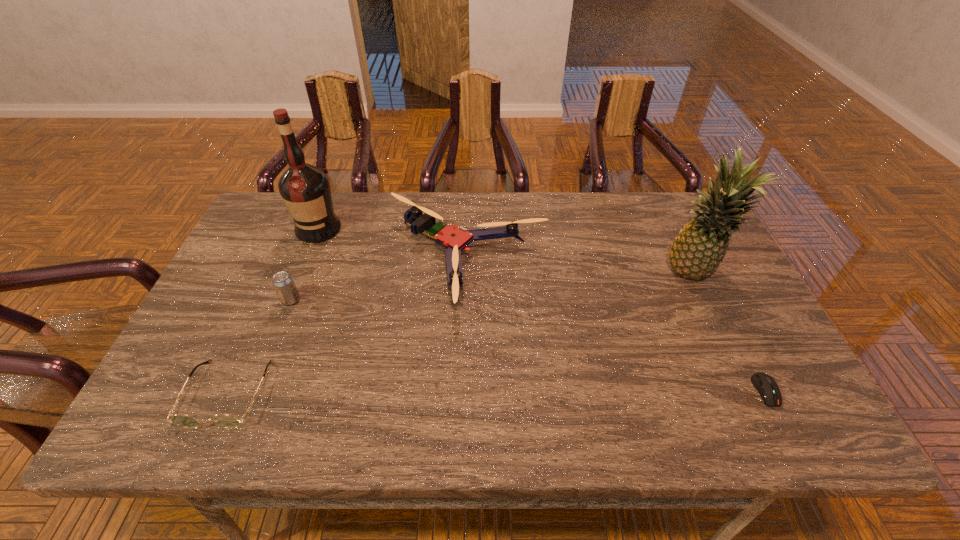
You are a GUI agent. You are given a task and a screenshot of the screen. Output one action in this format:
    pyautogui.click(x=<x>, y=<y>)
    Task: Click on the liquor
    
    Given the screenshot: What is the action you would take?
    pyautogui.click(x=305, y=189)

The height and width of the screenshot is (540, 960). In order to click on pineapple in this screenshot , I will do `click(698, 249)`.

Identify the location of the third object from right to left. (x=455, y=239).

What are the coordinates of `beer can` in the screenshot? It's located at (283, 283).

At what (x,y) coordinates should I click in order to perform the action: click on spectacles. Please return your answer as a coordinate pair (x, y). The height and width of the screenshot is (540, 960). Looking at the image, I should click on (226, 421).

Locate an element on the screen. This screenshot has height=540, width=960. computer equipment is located at coordinates (767, 387).

Where is `vacant space located 0.240m on the surface of the liquor`? This screenshot has width=960, height=540. vacant space located 0.240m on the surface of the liquor is located at coordinates (288, 305).

Where is `free location located on the left of the pineapple`? free location located on the left of the pineapple is located at coordinates (620, 274).

In order to click on free spot located 0.060m on the front of the fourth object from left to right in this screenshot , I will do `click(466, 342)`.

The width and height of the screenshot is (960, 540). Identify the location of vacant space located on the right of the beer can. (450, 300).